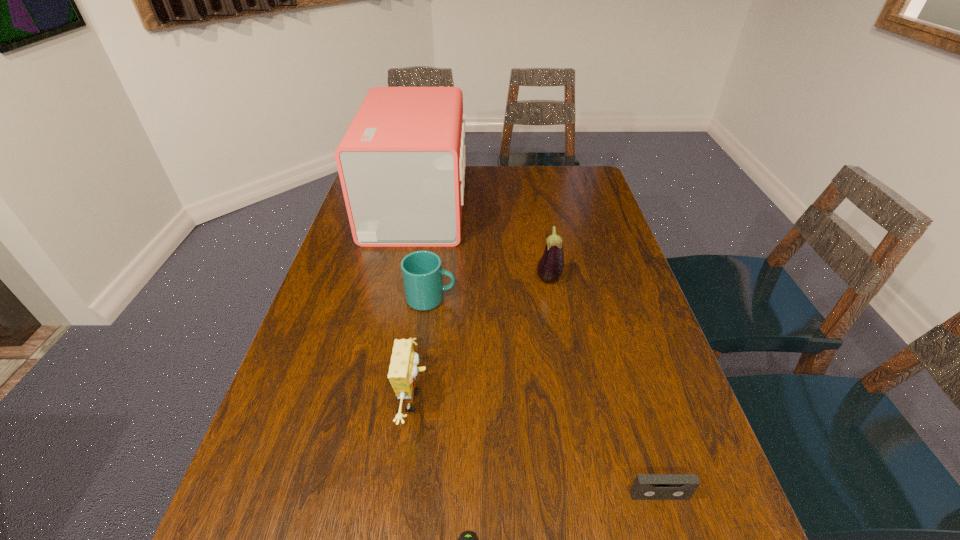
You are a GUI agent. You are given a task and a screenshot of the screen. Output one action in this format:
    pyautogui.click(x=<x>, y=<y>)
    Task: Click on the free spot located 0.210m on the face of the sponge
    
    Given the screenshot: What is the action you would take?
    pyautogui.click(x=527, y=402)

Where is `free point located on the handle side of the third shortest object`? The image size is (960, 540). free point located on the handle side of the third shortest object is located at coordinates (541, 299).

Identify the location of object that is at the far edge. (401, 163).

Locate an element on the screen. The width and height of the screenshot is (960, 540). object that is at the left edge is located at coordinates (401, 163).

Where is `object located at the right edge`? The height and width of the screenshot is (540, 960). object located at the right edge is located at coordinates (645, 486).

Identify the location of object located in the far left corner section of the desktop. (401, 163).

The height and width of the screenshot is (540, 960). In order to click on blank area at the far edge in this screenshot , I will do `click(545, 167)`.

Image resolution: width=960 pixels, height=540 pixels. In the image, there is a desktop. Identify the location of vacant space at the left edge. (352, 254).

In the image, there is a desktop. Where is `vacant space at the right edge`? The height and width of the screenshot is (540, 960). vacant space at the right edge is located at coordinates (579, 256).

Find the location of a particular element. free space at the far right corner of the desktop is located at coordinates (560, 178).